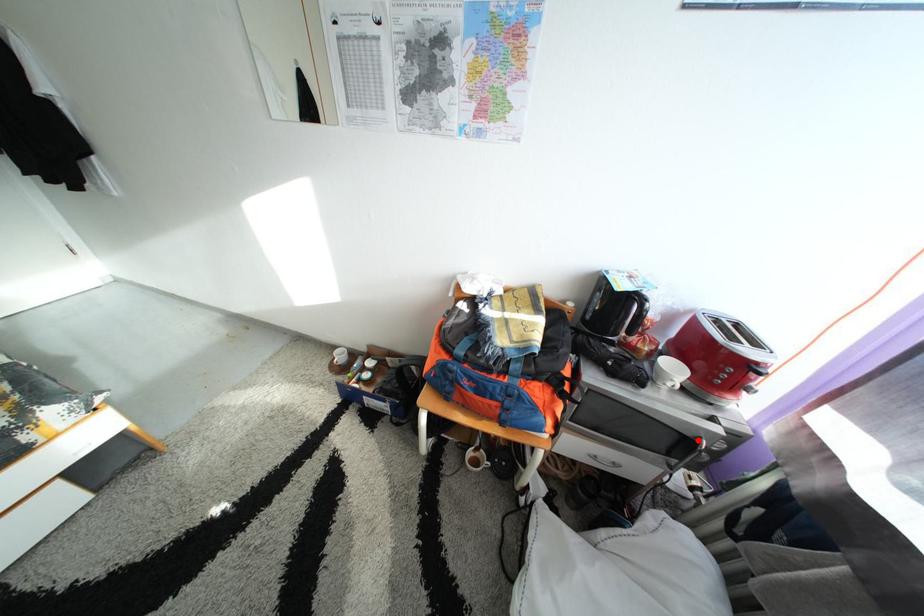
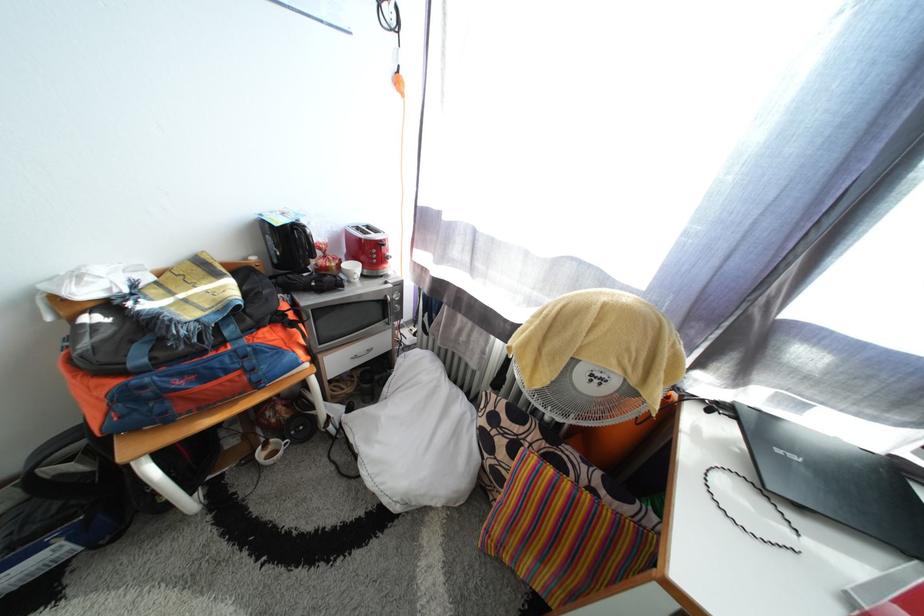
Question: A red point is marked in image1. In image2, is the corresponding 3D point closer to the camera or farther? Reply with the corresponding letter.

Choices:
 (A) The corresponding 3D point is closer.
 (B) The corresponding 3D point is farther.

Answer: (A)